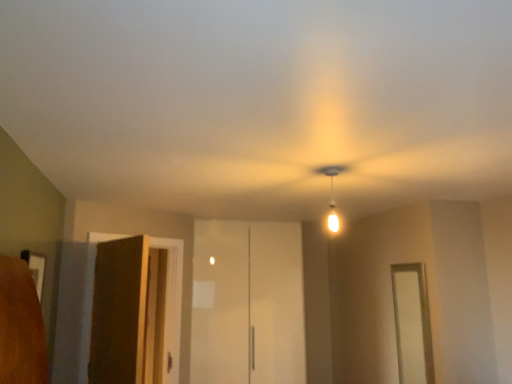
Question: From a real-world perspective, is matte white bulb at center beneath brown wood elevator at left, the 1th elevator positioned from the front?

Choices:
 (A) no
 (B) yes

Answer: (A)

Question: Is matte white bulb at center positioned with its back to brown wood elevator at left, the 1th elevator positioned from the front?

Choices:
 (A) yes
 (B) no

Answer: (B)

Question: Is matte white bulb at center with brown wood elevator at left, the second elevator from the right?

Choices:
 (A) yes
 (B) no

Answer: (B)

Question: Does matte white bulb at center have a greater width compared to brown wood elevator at left, the second elevator from the right?

Choices:
 (A) yes
 (B) no

Answer: (B)

Question: Is matte white bulb at center at the right side of brown wood elevator at left, the second elevator from the right?

Choices:
 (A) yes
 (B) no

Answer: (A)

Question: Is matte white bulb at center outside brown wood elevator at left, arranged as the second elevator when viewed from the back?

Choices:
 (A) no
 (B) yes

Answer: (B)

Question: Is matte white bulb at center completely or partially inside white glossy door at right?

Choices:
 (A) no
 (B) yes

Answer: (A)

Question: Is white glossy door at right to the left of matte white bulb at center from the viewer's perspective?

Choices:
 (A) yes
 (B) no

Answer: (B)

Question: Is white glossy door at right not inside matte white bulb at center?

Choices:
 (A) yes
 (B) no

Answer: (A)

Question: Does white glossy door at right have a larger size compared to matte white bulb at center?

Choices:
 (A) no
 (B) yes

Answer: (B)

Question: From the image's perspective, is white glossy door at right under matte white bulb at center?

Choices:
 (A) yes
 (B) no

Answer: (A)

Question: Considering the relative sizes of white glossy door at right and matte white bulb at center in the image provided, is white glossy door at right thinner than matte white bulb at center?

Choices:
 (A) yes
 (B) no

Answer: (B)

Question: From a real-world perspective, is brown wood elevator at left, the 1th elevator positioned from the front, under white glossy door at right?

Choices:
 (A) yes
 (B) no

Answer: (B)